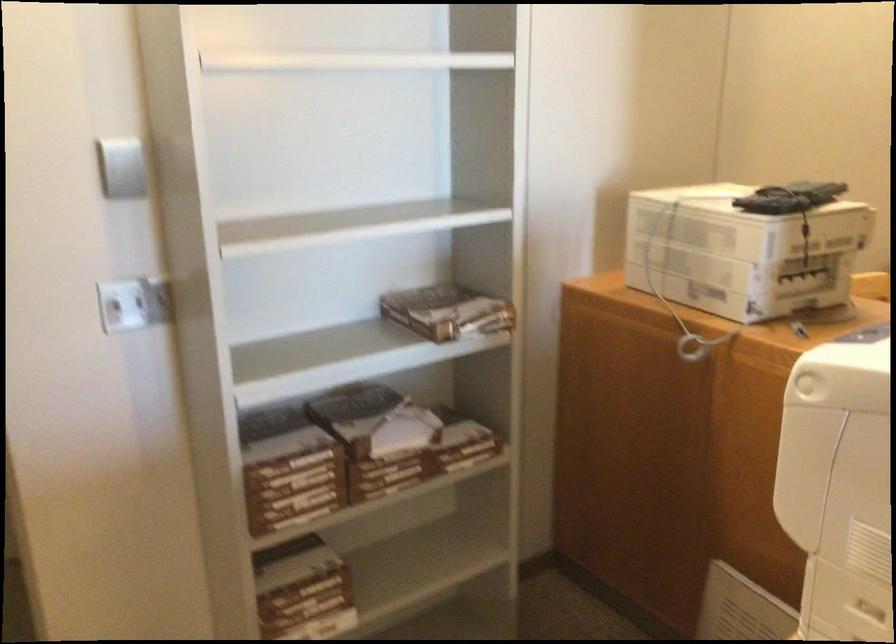
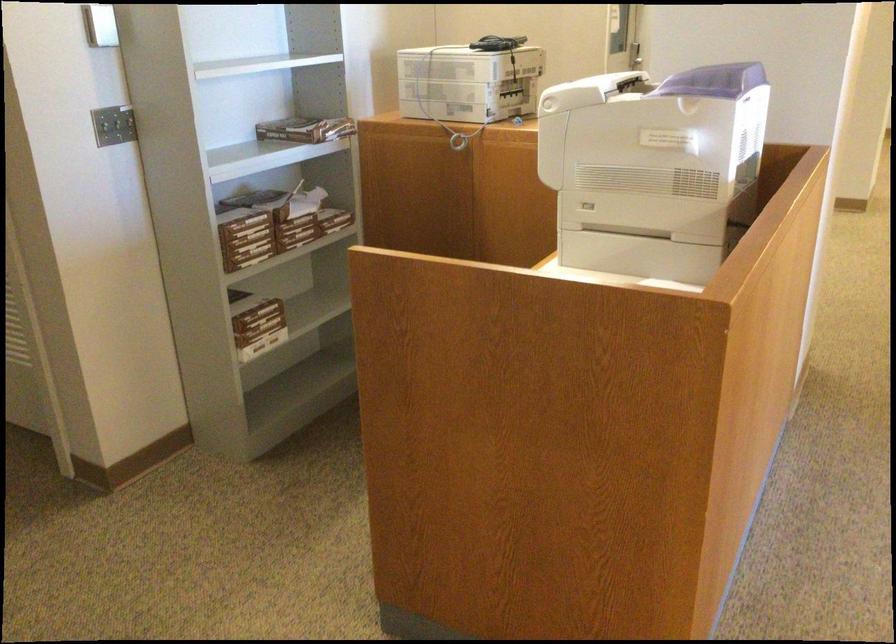
In the second image, find the point that corresponds to pixel 293 495 in the first image.

(246, 237)